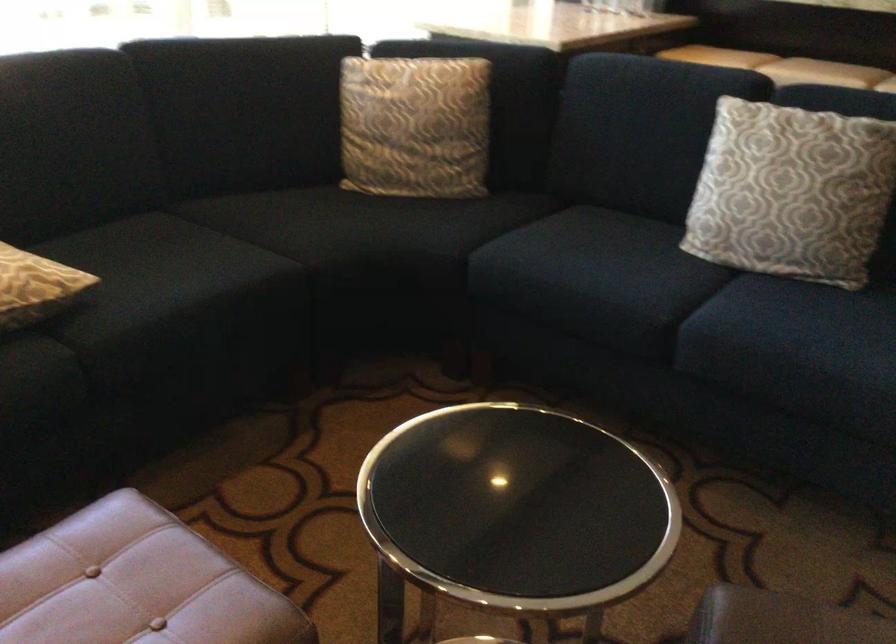
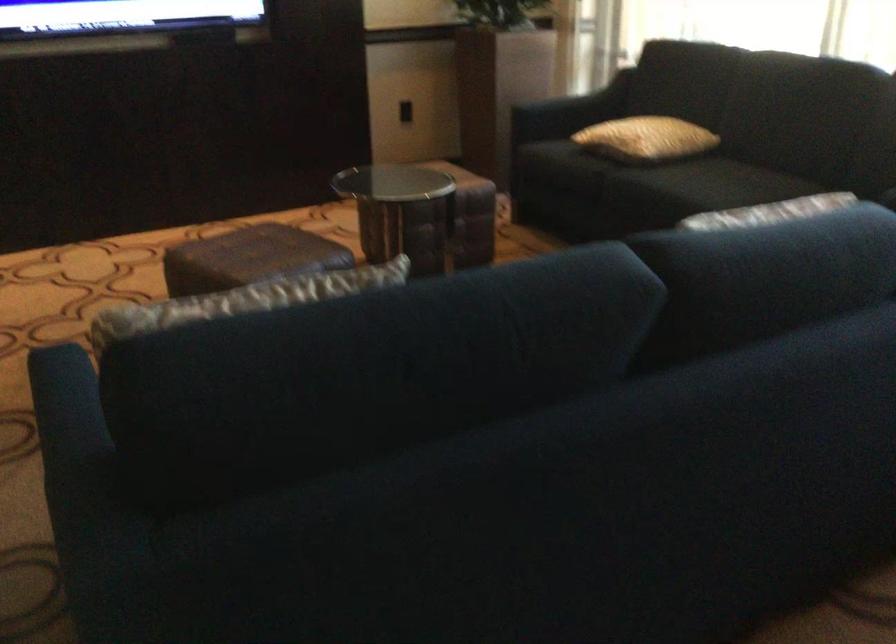
Question: I am providing you with two images of the same scene from different viewpoints. Please identify which objects are invisible in image2.

Choices:
 (A) patterned pillow
 (B) sofa sitting surface
 (C) brown leather ottoman
 (D) white plastic basket

Answer: (A)